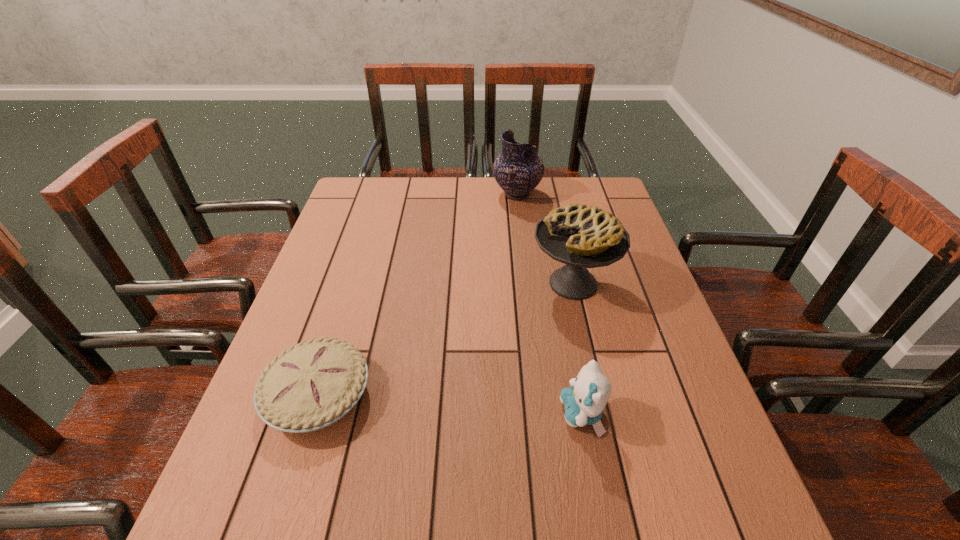
Where is `free spot between the leftmost object and the farthest object`? free spot between the leftmost object and the farthest object is located at coordinates (418, 295).

The image size is (960, 540). What are the coordinates of `vacant space that's between the kitten and the taller pie` in the screenshot? It's located at (577, 349).

Where is `free spot between the farthest object and the third tallest object`? The image size is (960, 540). free spot between the farthest object and the third tallest object is located at coordinates (549, 304).

At what (x,y) coordinates should I click in order to perform the action: click on unoccupied area between the farthest object and the leftmost object. Please return your answer as a coordinate pair (x, y). The image size is (960, 540). Looking at the image, I should click on (418, 295).

The image size is (960, 540). I want to click on free point between the nearer pie and the second shortest object, so click(x=450, y=404).

Identify the location of vacant region between the taller pie and the shorter pie. (445, 339).

You are a GUI agent. You are given a task and a screenshot of the screen. Output one action in this format:
    pyautogui.click(x=<x>, y=<y>)
    Task: Click on the empty location between the third tallest object and the pottery
    This screenshot has width=960, height=540.
    Given the screenshot: What is the action you would take?
    pyautogui.click(x=549, y=304)

Where is `unoccupied area between the pottery and the kitten`? unoccupied area between the pottery and the kitten is located at coordinates (549, 304).

Image resolution: width=960 pixels, height=540 pixels. I want to click on object identified as the third closest to the left pie, so click(x=518, y=170).

The height and width of the screenshot is (540, 960). In order to click on object that is the third closest to the farthest object in this screenshot , I will do `click(584, 402)`.